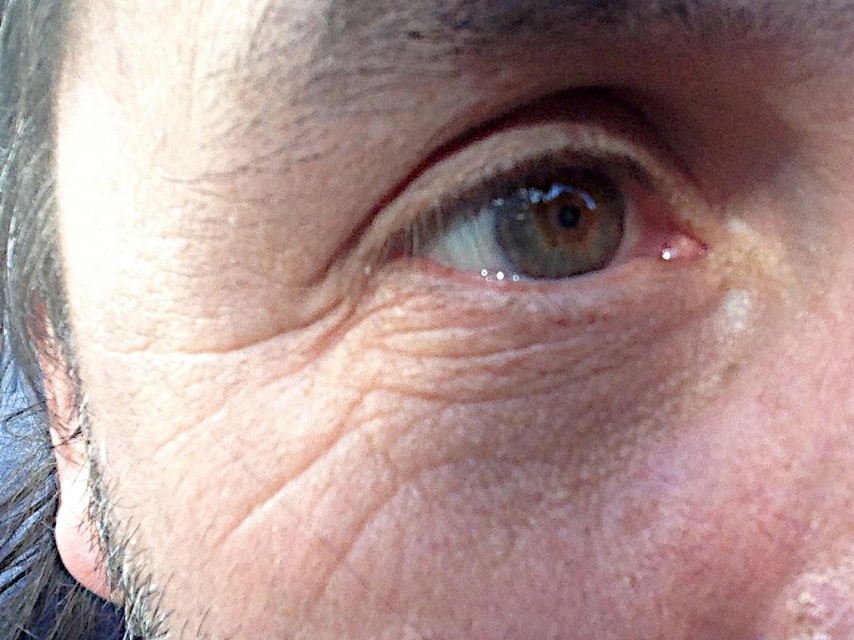
From the picture: Which is above, green matte eye at center or transparent skin at upper center?

green matte eye at center is above.

Based on the photo, does green matte eye at center have a greater height compared to transparent skin at upper center?

Indeed, green matte eye at center has a greater height compared to transparent skin at upper center.

Is point (501, 208) farther from camera compared to point (630, 211)?

That is False.

Identify the location of green matte eye at center. Image resolution: width=854 pixels, height=640 pixels. (541, 209).